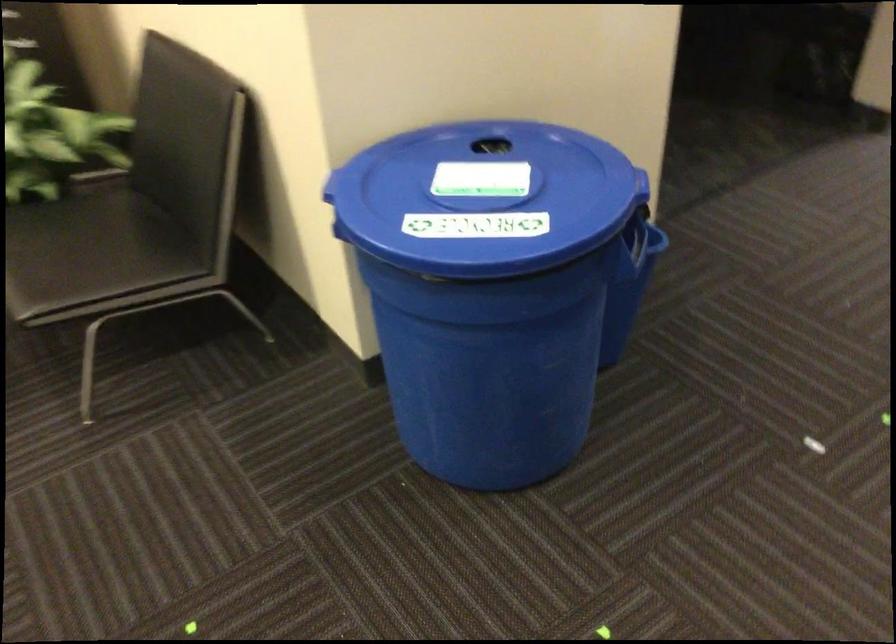
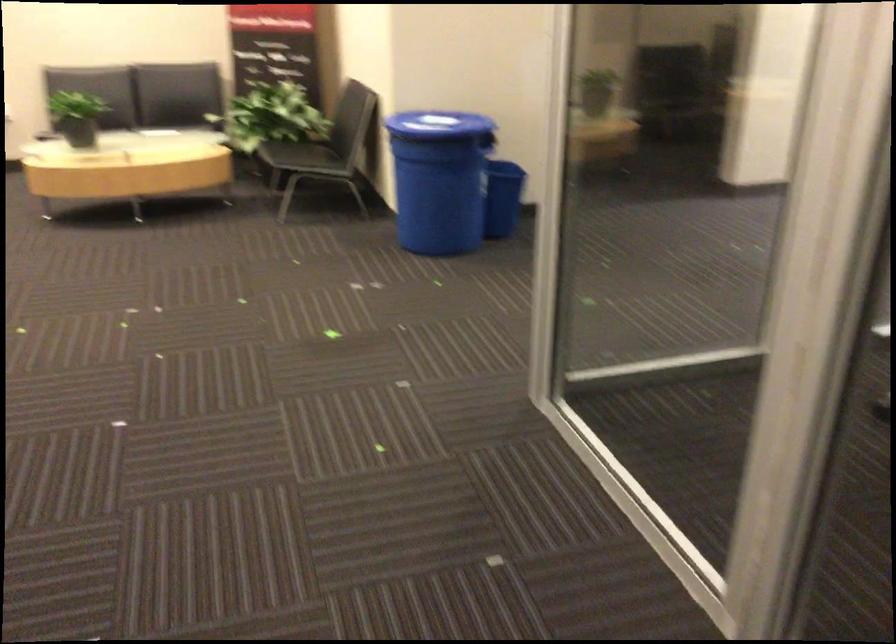
Find the pixel in the second image that matches point 630,325 in the first image.

(502, 198)